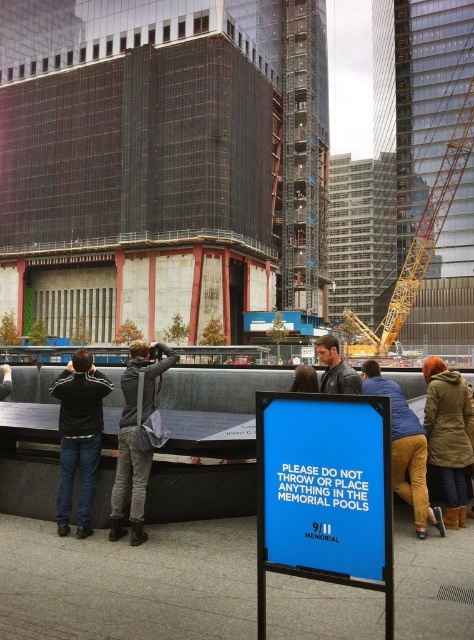
Question: Based on their relative distances, which object is nearer to the gray jeans at center?

Choices:
 (A) yellow hard hat at lower right
 (B) yellow metallic crane at center
 (C) concrete wall at center
 (D) black matte jacket at left

Answer: (D)

Question: Is the position of black matte jacket at left more distant than that of gray jeans at center?

Choices:
 (A) yes
 (B) no

Answer: (A)

Question: Which of the following is the closest to the observer?

Choices:
 (A) leather jacket at center
 (B) yellow hard hat at lower right
 (C) concrete wall at center
 (D) black matte jacket at left

Answer: (B)

Question: Does concrete wall at center have a larger size compared to yellow hard hat at lower right?

Choices:
 (A) yes
 (B) no

Answer: (B)

Question: Is concrete wall at center closer to camera compared to yellow metallic crane at center?

Choices:
 (A) no
 (B) yes

Answer: (B)

Question: Which of the following is the farthest from the observer?

Choices:
 (A) (447, 582)
 (B) (402, 268)
 (C) (406, 410)

Answer: (B)